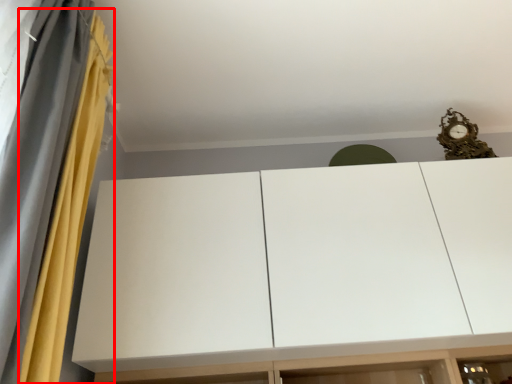
Question: In this image, where is curtain (annotated by the red box) located relative to cupboard?

Choices:
 (A) right
 (B) left

Answer: (B)